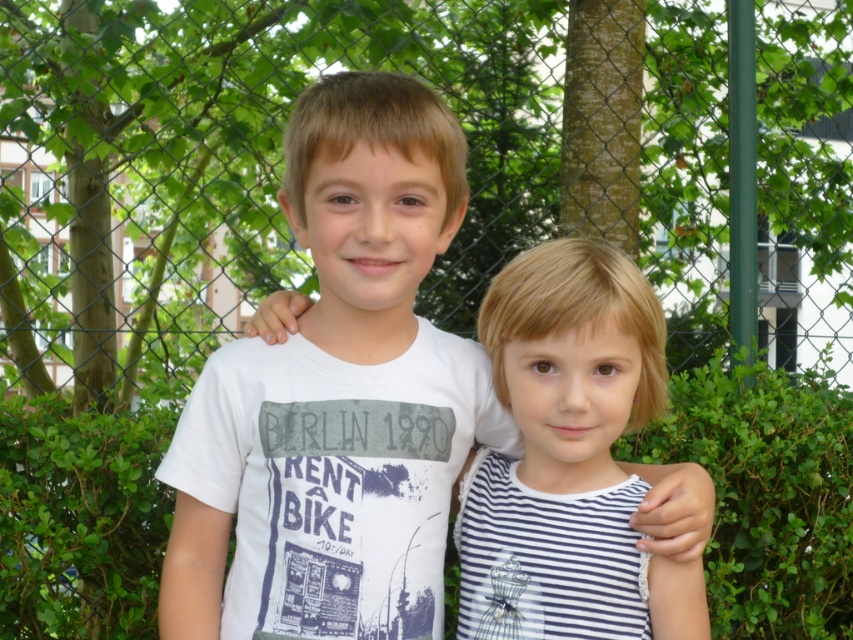
You are a photographer trying to capture the perfect shot of the two children standing next to the green leafy hedge at center. Based on the coordinates provided, where should you position your camera to ensure the hedge is centered in the frame?

The green leafy hedge at center is located at coordinates point (766, 496), so positioning the camera directly facing this point will center the hedge in the frame.

Looking at this image, you are a photographer trying to capture a photo of the white striped dress at center and the green leafy hedge at center. Based on their positions, which object is closer to the camera?

The white striped dress at center is closer to the camera because the green leafy hedge at center is positioned under it, indicating it is behind.

Based on the photo, you are a photographer taking a picture of the two children in the scene. The green leafy hedge at center and the white striped dress at center are both in the frame. Which object takes up more space in the photo?

The green leafy hedge at center takes up more space in the photo because it is bigger than the white striped dress at center.